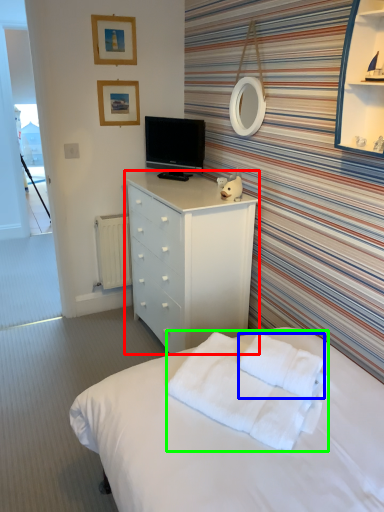
Question: Based on their relative distances, which object is farther from chest of drawers (highlighted by a red box)? Choose from cloth (highlighted by a blue box) and blanket (highlighted by a green box).

Choices:
 (A) cloth
 (B) blanket

Answer: (A)